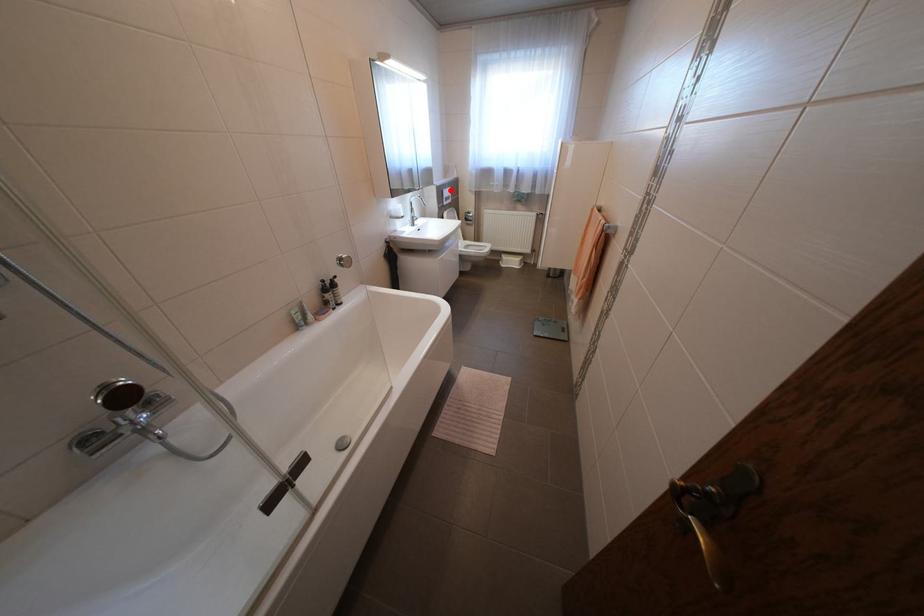
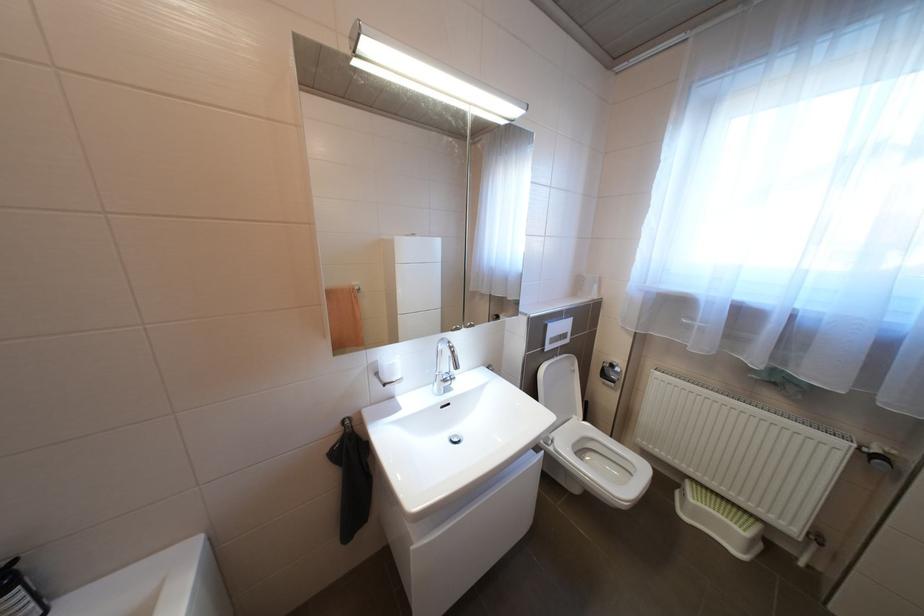
Question: A red point is marked in image1. In image2, is the corresponding 3D point closer to the camera or farther? Reply with the corresponding letter.

Choices:
 (A) The corresponding 3D point is closer.
 (B) The corresponding 3D point is farther.

Answer: (B)